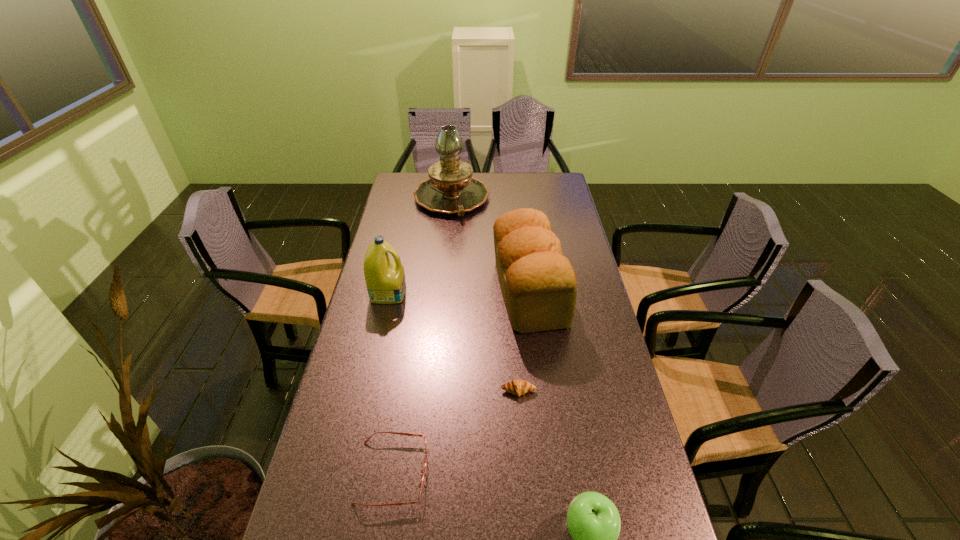
At what (x,y) coordinates should I click in order to perform the action: click on free space located 0.180m on the lenses of the second shortest object. Please return your answer as a coordinate pair (x, y). This screenshot has height=540, width=960. Looking at the image, I should click on 502,472.

Locate an element on the screen. vacant region located on the front-facing side of the shortest object is located at coordinates (520, 414).

Where is `object located at the far edge`? object located at the far edge is located at coordinates (450, 189).

Locate an element on the screen. oil lamp that is at the left edge is located at coordinates (450, 189).

Where is `detergent located at the left edge`? Image resolution: width=960 pixels, height=540 pixels. detergent located at the left edge is located at coordinates (385, 279).

Locate an element on the screen. The height and width of the screenshot is (540, 960). spectacles located at the left edge is located at coordinates (400, 433).

This screenshot has height=540, width=960. I want to click on object that is positioned at the right edge, so click(x=539, y=286).

At what (x,y) coordinates should I click in order to perform the action: click on object that is positioned at the far left corner. Please return your answer as a coordinate pair (x, y). This screenshot has height=540, width=960. Looking at the image, I should click on (450, 189).

Find the location of a particular element. This screenshot has height=540, width=960. vacant region at the far edge of the desktop is located at coordinates (511, 181).

Locate an element on the screen. vacant area at the left edge of the desktop is located at coordinates (370, 467).